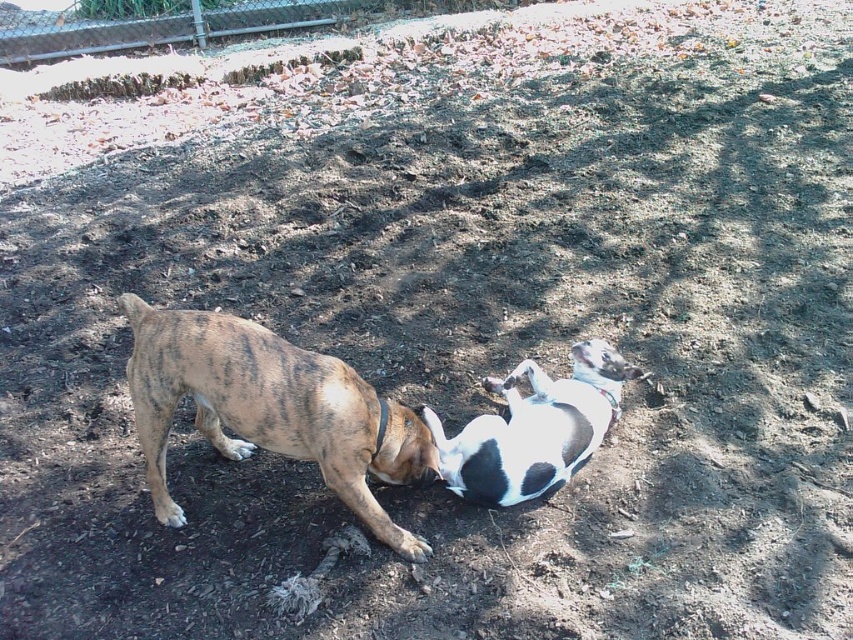
You are a photographer standing at the camera position. You want to take a photo of the brindle fur dog at center. If you move forward 2 feet, will the dog still be in focus?

The brindle fur dog at center is currently 6.66 feet away from the camera. Moving forward 2 feet would bring you to 4.66 feet away. Whether the dog stays in focus depends on the camera lens and aperture settings, but generally, moving closer reduces depth of field, potentially making the dog less in focus unless adjusted.

You are a photographer trying to capture a photo of both dogs in the image. You notice two specific points marked in the scene. The first point, labeled as point (320,460), is located near the brindle dog, while the second point, labeled as point (598,368), is near the white and black dog. Since you want to focus on the dog that is closer to you, which point should you adjust your camera to focus on?

Point (320,460) is closer to the viewer than point (598,368), so you should focus your camera on point (320,460) to capture the brindle dog that is nearer to you.